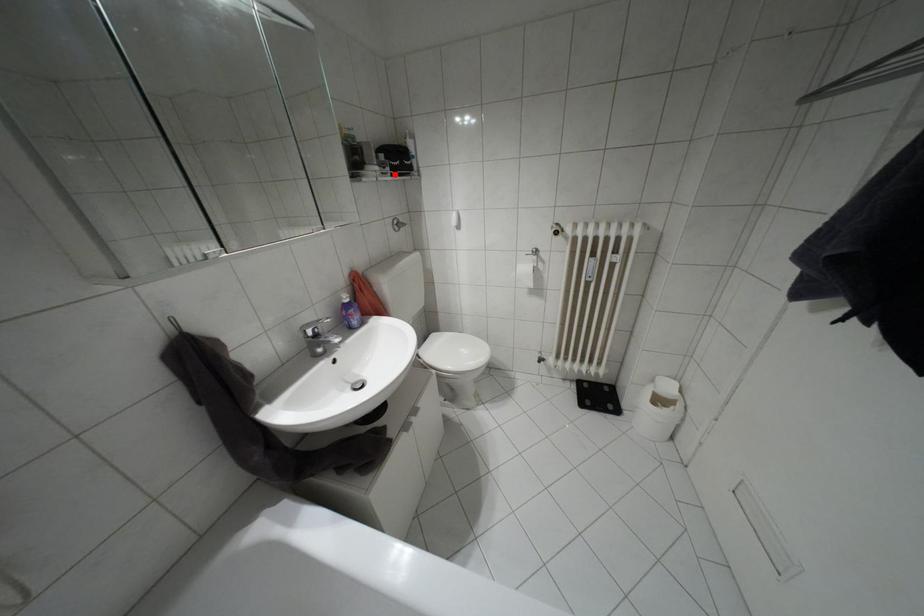
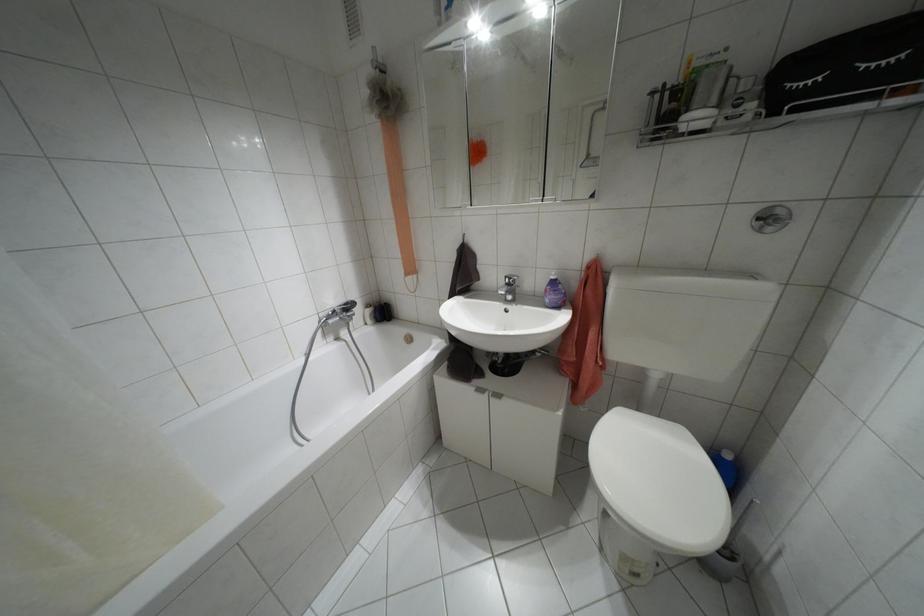
Question: I am providing you with two images of the same scene from different viewpoints. Given a red point in image1, look at the same physical point in image2. Is it:

Choices:
 (A) Closer to the viewpoint
 (B) Farther from the viewpoint

Answer: (B)